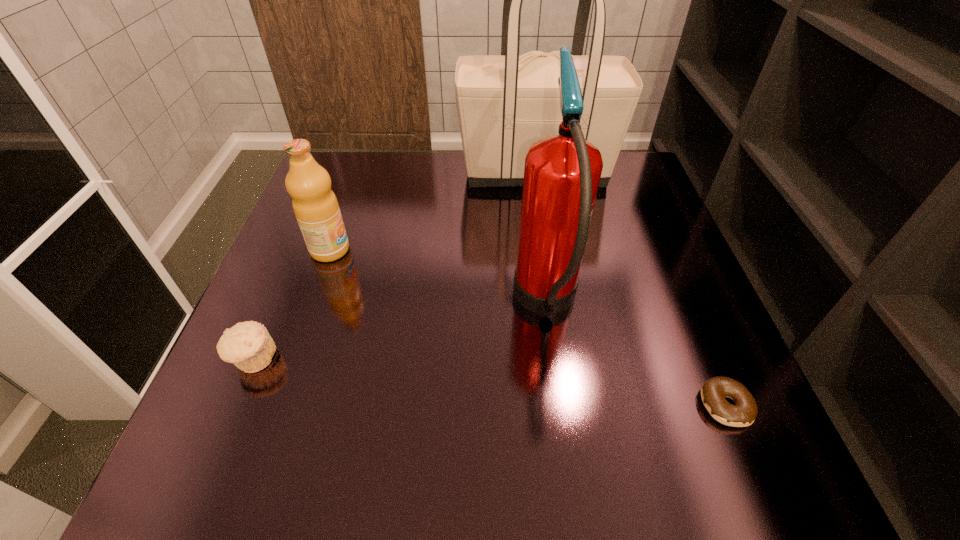
Locate an element on the screen. This screenshot has width=960, height=540. free space in the image that satisfies the following two spatial constraints: 1. on the front label of the third shortest object; 2. on the back side of the second tallest object is located at coordinates coord(311,304).

I want to click on free spot that satisfies the following two spatial constraints: 1. on the front label of the fourth shortest object; 2. on the right side of the third tallest object, so click(311, 304).

Identify the location of vacant space that satisfies the following two spatial constraints: 1. on the back side of the fire extinguisher; 2. on the front label of the fruit juice. (539, 250).